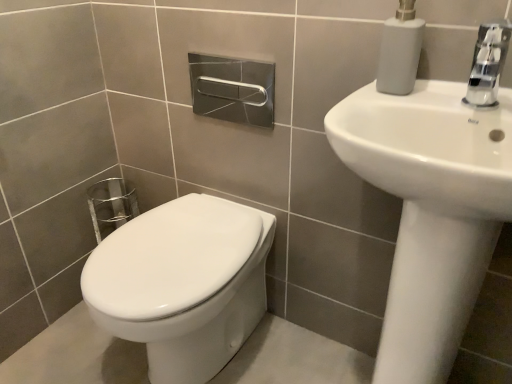
Where is `white glossy toilet at lower left`? This screenshot has width=512, height=384. white glossy toilet at lower left is located at coordinates [x=183, y=283].

This screenshot has width=512, height=384. In order to click on chrome metallic faucet at upper right in this screenshot , I will do `click(488, 63)`.

Locate an element on the screen. Image resolution: width=512 pixels, height=384 pixels. white glossy toilet at lower left is located at coordinates (183, 283).

Would you say white glossy sink at upper right is to the left or to the right of chrome metallic faucet at upper right in the picture?

white glossy sink at upper right is to the left of chrome metallic faucet at upper right.

How many degrees apart are the facing directions of white glossy sink at upper right and chrome metallic faucet at upper right?

white glossy sink at upper right and chrome metallic faucet at upper right are facing 0.000268 degrees away from each other.

Is white glossy sink at upper right wider than chrome metallic faucet at upper right?

Yes, white glossy sink at upper right is wider than chrome metallic faucet at upper right.

Considering the relative sizes of white glossy sink at upper right and chrome metallic faucet at upper right in the image provided, is white glossy sink at upper right shorter than chrome metallic faucet at upper right?

Incorrect, the height of white glossy sink at upper right does not fall short of that of chrome metallic faucet at upper right.

From a real-world perspective, is white glossy sink at upper right above or below white matte soap dispenser at upper right?

In terms of real-world spatial position, white glossy sink at upper right is below white matte soap dispenser at upper right.

Between white glossy sink at upper right and white matte soap dispenser at upper right, which one has larger width?

white glossy sink at upper right is wider.

Is white glossy sink at upper right not close to white matte soap dispenser at upper right?

No.

What's the angular difference between white glossy sink at upper right and white matte soap dispenser at upper right's facing directions?

white glossy sink at upper right and white matte soap dispenser at upper right are facing 0.000836 degrees away from each other.

How many degrees apart are the facing directions of white matte soap dispenser at upper right and white glossy sink at upper right?

white matte soap dispenser at upper right and white glossy sink at upper right are facing 0.000836 degrees away from each other.

Could white glossy sink at upper right be considered to be inside white matte soap dispenser at upper right?

No, white glossy sink at upper right is not inside white matte soap dispenser at upper right.

Is point (405, 87) closer to viewer compared to point (444, 152)?

No, (405, 87) is behind (444, 152).

Locate an element on the screen. The width and height of the screenshot is (512, 384). soap dispenser located behind the white glossy sink at upper right is located at coordinates (400, 51).

Is white glossy toilet at lower left with white matte soap dispenser at upper right?

No.

From the image's perspective, between white glossy toilet at lower left and white matte soap dispenser at upper right, which one is located above?

white matte soap dispenser at upper right.

From a real-world perspective, is white glossy toilet at lower left above or below white matte soap dispenser at upper right?

white glossy toilet at lower left is situated lower than white matte soap dispenser at upper right in the real world.

Could white glossy toilet at lower left be considered to be inside white glossy sink at upper right?

No, white glossy toilet at lower left is not surrounded by white glossy sink at upper right.

From the image's perspective, which one is positioned higher, white glossy sink at upper right or white glossy toilet at lower left?

white glossy sink at upper right, from the image's perspective.

Considering the relative sizes of white glossy sink at upper right and white glossy toilet at lower left in the image provided, is white glossy sink at upper right smaller than white glossy toilet at lower left?

No, white glossy sink at upper right is not smaller than white glossy toilet at lower left.

From a real-world perspective, which is physically above, white glossy sink at upper right or white glossy toilet at lower left?

In real-world perspective, white glossy sink at upper right is above.

Can white glossy toilet at lower left be found inside white matte soap dispenser at upper right?

No, white glossy toilet at lower left is not a part of white matte soap dispenser at upper right.

Is white matte soap dispenser at upper right positioned behind white glossy toilet at lower left?

No.

How different are the orientations of white matte soap dispenser at upper right and white glossy toilet at lower left in degrees?

There is a 0.000631-degree angle between the facing directions of white matte soap dispenser at upper right and white glossy toilet at lower left.

Does white matte soap dispenser at upper right appear on the right side of white glossy toilet at lower left?

Indeed, white matte soap dispenser at upper right is positioned on the right side of white glossy toilet at lower left.

Would you say chrome metallic faucet at upper right is outside white glossy toilet at lower left?

Yes, chrome metallic faucet at upper right is outside of white glossy toilet at lower left.

Consider the image. Can you tell me how much chrome metallic faucet at upper right and white glossy toilet at lower left differ in facing direction?

0.000419 degrees.

Which point is more forward, (493, 80) or (201, 226)?

Point (493, 80)

Which object is further away from the camera taking this photo, chrome metallic faucet at upper right or white glossy toilet at lower left?

white glossy toilet at lower left is more distant.

The height and width of the screenshot is (384, 512). I want to click on sink that is in front of the chrome metallic faucet at upper right, so click(434, 201).

This screenshot has height=384, width=512. I want to click on sink below the white matte soap dispenser at upper right (from the image's perspective), so click(x=434, y=201).

From the image, which object appears to be farther from white matte soap dispenser at upper right, chrome metallic faucet at upper right or white glossy sink at upper right?

white glossy sink at upper right lies further to white matte soap dispenser at upper right than the other object.

Consider the image. From the image, which object appears to be nearer to white matte soap dispenser at upper right, white glossy sink at upper right or white glossy toilet at lower left?

white glossy sink at upper right.

Which object lies nearer to the anchor point white glossy toilet at lower left, white matte soap dispenser at upper right or chrome metallic faucet at upper right?

Based on the image, white matte soap dispenser at upper right appears to be nearer to white glossy toilet at lower left.

Estimate the real-world distances between objects in this image. Which object is closer to white matte soap dispenser at upper right, white glossy toilet at lower left or white glossy sink at upper right?

Based on the image, white glossy sink at upper right appears to be nearer to white matte soap dispenser at upper right.

Which object lies further to the anchor point chrome metallic faucet at upper right, white glossy toilet at lower left or white matte soap dispenser at upper right?

Based on the image, white glossy toilet at lower left appears to be further to chrome metallic faucet at upper right.

Which object lies nearer to the anchor point white glossy toilet at lower left, white glossy sink at upper right or white matte soap dispenser at upper right?

Based on the image, white glossy sink at upper right appears to be nearer to white glossy toilet at lower left.

Based on their spatial positions, is white matte soap dispenser at upper right or white glossy toilet at lower left closer to chrome metallic faucet at upper right?

Based on the image, white matte soap dispenser at upper right appears to be nearer to chrome metallic faucet at upper right.

Considering their positions, is chrome metallic faucet at upper right positioned further to white glossy sink at upper right than white matte soap dispenser at upper right?

white matte soap dispenser at upper right is positioned further to the anchor white glossy sink at upper right.

The height and width of the screenshot is (384, 512). What are the coordinates of `sink between white glossy toilet at lower left and chrome metallic faucet at upper right in the horizontal direction` in the screenshot? It's located at (434, 201).

The width and height of the screenshot is (512, 384). What are the coordinates of `sink between white matte soap dispenser at upper right and white glossy toilet at lower left vertically` in the screenshot? It's located at (434, 201).

At what (x,y) coordinates should I click in order to perform the action: click on tap between white matte soap dispenser at upper right and white glossy toilet at lower left in the up-down direction. Please return your answer as a coordinate pair (x, y). Looking at the image, I should click on (488, 63).

Locate an element on the screen. The image size is (512, 384). tap between white matte soap dispenser at upper right and white glossy sink at upper right from top to bottom is located at coordinates (488, 63).